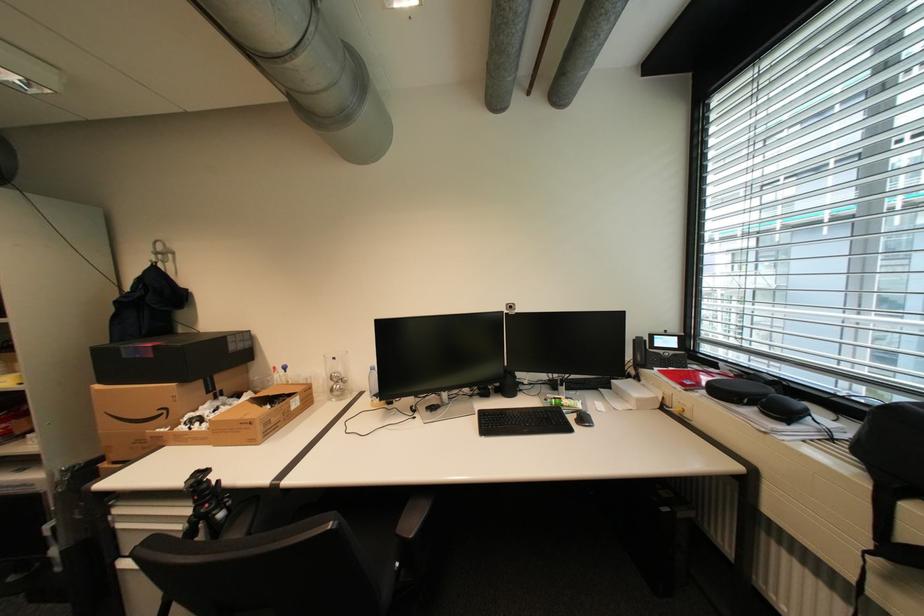
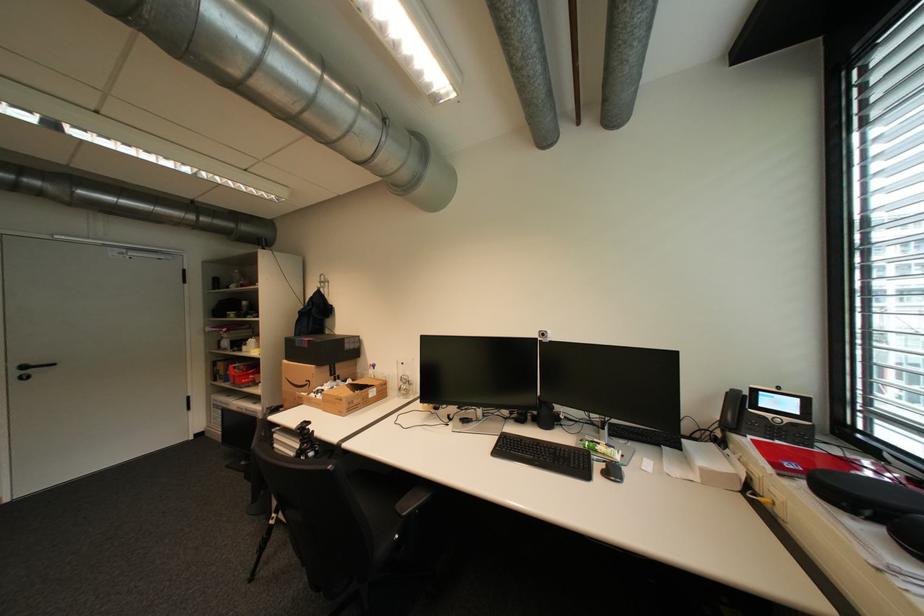
Find the pixel in the second image that matches [406,565] in the first image.

(406, 537)